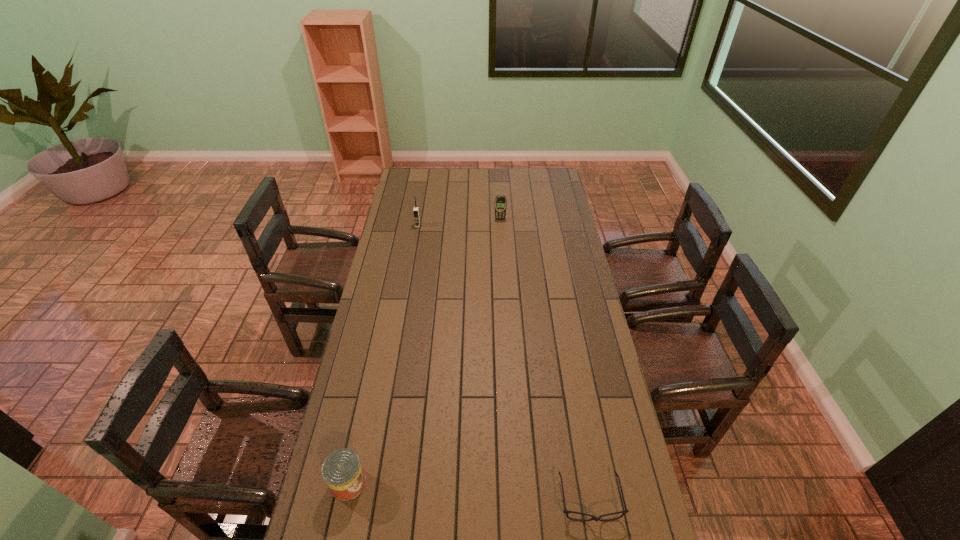
I want to click on vacant space positioned 0.090m on the back of the leftmost object, so click(358, 437).

Identify the location of cellular telephone at the left edge. (416, 209).

The image size is (960, 540). In order to click on can that is positioned at the left edge in this screenshot , I will do `click(342, 471)`.

I want to click on object situated at the right edge, so click(625, 511).

Image resolution: width=960 pixels, height=540 pixels. Identify the location of free space at the far edge of the desktop. (473, 179).

In order to click on blank space at the left edge of the desktop in this screenshot , I will do (378, 326).

In the image, there is a desktop. At what (x,y) coordinates should I click in order to perform the action: click on vacant space at the right edge. Please return your answer as a coordinate pair (x, y). The height and width of the screenshot is (540, 960). Looking at the image, I should click on [588, 380].

The width and height of the screenshot is (960, 540). I want to click on vacant space at the far left corner of the desktop, so click(430, 170).

This screenshot has height=540, width=960. I want to click on free space at the far right corner of the desktop, so click(x=542, y=172).

In order to click on free space between the taller cellular telephone and the third shortest object in this screenshot , I will do (459, 222).